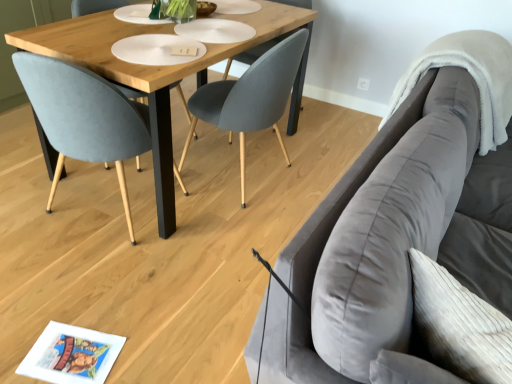
Question: Considering the positions of white fluffy blanket at upper right and wooden table at center in the image, is white fluffy blanket at upper right taller or shorter than wooden table at center?

Choices:
 (A) tall
 (B) short

Answer: (B)

Question: Does point (480, 125) appear closer or farther from the camera than point (115, 64)?

Choices:
 (A) farther
 (B) closer

Answer: (A)

Question: Which object is the closest to the matte gray chair at center, the 1th chair in the right-to-left sequence?

Choices:
 (A) velvet blue chair at center, which appears as the 1th chair when viewed from the left
 (B) white fluffy blanket at upper right
 (C) velvet gray couch at right
 (D) wooden table at center

Answer: (D)

Question: Which is farther from the velvet gray couch at right?

Choices:
 (A) wooden table at center
 (B) matte gray chair at center, the 1th chair in the right-to-left sequence
 (C) velvet blue chair at center, which appears as the 1th chair when viewed from the left
 (D) white fluffy blanket at upper right

Answer: (C)